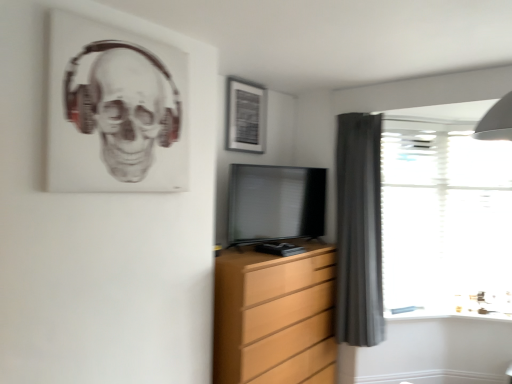
Question: In the image, is dark gray fabric curtain at right positioned in front of or behind matte black tv at center?

Choices:
 (A) front
 (B) behind

Answer: (B)

Question: Considering the positions of dark gray fabric curtain at right and matte black tv at center in the image, is dark gray fabric curtain at right bigger or smaller than matte black tv at center?

Choices:
 (A) big
 (B) small

Answer: (A)

Question: Based on their relative distances, which object is nearer to the dark gray fabric curtain at right?

Choices:
 (A) wooden chest of drawers at center
 (B) transparent plastic window at right
 (C) matte black tv at center
 (D) matte black picture frame at upper center
 (E) transparent glass door at right

Answer: (E)

Question: Which is farther from the dark gray fabric curtain at right?

Choices:
 (A) wooden chest of drawers at center
 (B) matte black tv at center
 (C) transparent plastic window at right
 (D) matte black picture frame at upper center
 (E) transparent glass door at right

Answer: (D)